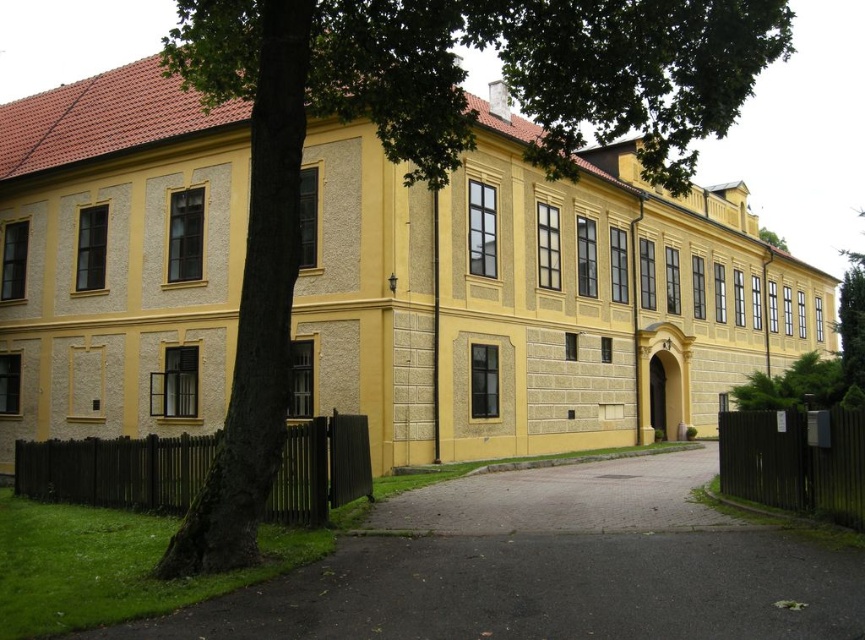
Question: Which is farther from the gray asphalt driveway at center?

Choices:
 (A) black asphalt driveway at lower center
 (B) green leafy tree at center
 (C) green leafy tree at upper right

Answer: (C)

Question: Can you confirm if gray asphalt driveway at center is positioned to the right of green leafy tree at upper right?

Choices:
 (A) yes
 (B) no

Answer: (B)

Question: Among these points, which one is farthest from the camera?

Choices:
 (A) (362, 634)
 (B) (777, 241)
 (C) (280, 52)

Answer: (B)

Question: Can you confirm if gray asphalt driveway at center is smaller than green leafy tree at upper right?

Choices:
 (A) no
 (B) yes

Answer: (B)

Question: Which point is closer to the camera?

Choices:
 (A) (235, 356)
 (B) (577, 628)
 (C) (774, 236)
 (D) (646, 516)

Answer: (B)

Question: Is green leafy tree at center closer to the viewer compared to black asphalt driveway at lower center?

Choices:
 (A) yes
 (B) no

Answer: (B)